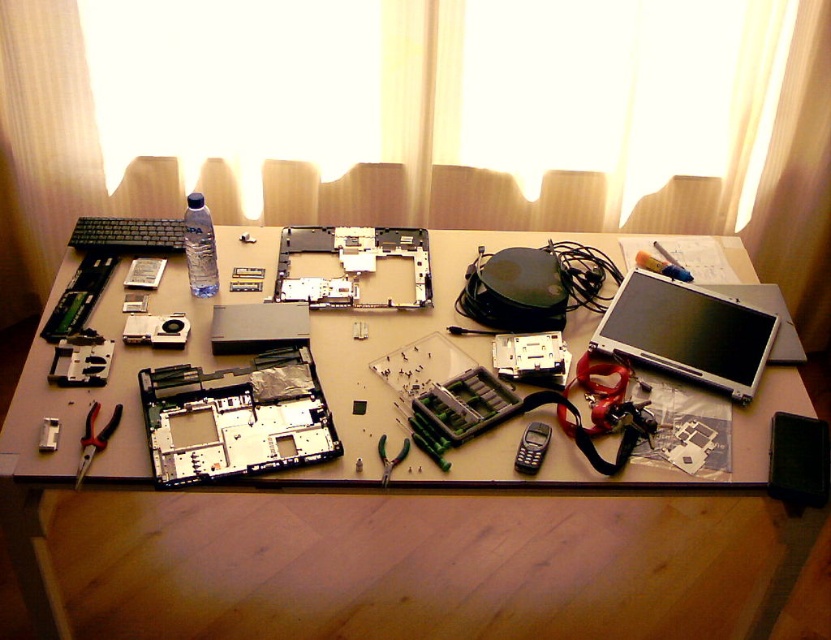
Does matte plastic motherboard at center have a smaller size compared to metallic silver pliers at lower left?

No, matte plastic motherboard at center is not smaller than metallic silver pliers at lower left.

Which is in front, point (364, 305) or point (87, 419)?

Point (87, 419) is more forward.

This screenshot has height=640, width=831. I want to click on matte plastic motherboard at center, so click(352, 264).

Which is above, matte plastic motherboard at center or black plastic phone at center?

matte plastic motherboard at center is above.

Does matte plastic motherboard at center have a smaller size compared to black plastic phone at center?

No.

Does point (288, 276) come in front of point (530, 461)?

That is False.

The image size is (831, 640). Identify the location of matte plastic motherboard at center. (352, 264).

What do you see at coordinates (687, 333) in the screenshot?
I see `satin silver laptop at center` at bounding box center [687, 333].

Between satin silver laptop at center and matte plastic motherboard at center, which one has less height?

matte plastic motherboard at center

Identify the location of satin silver laptop at center. (687, 333).